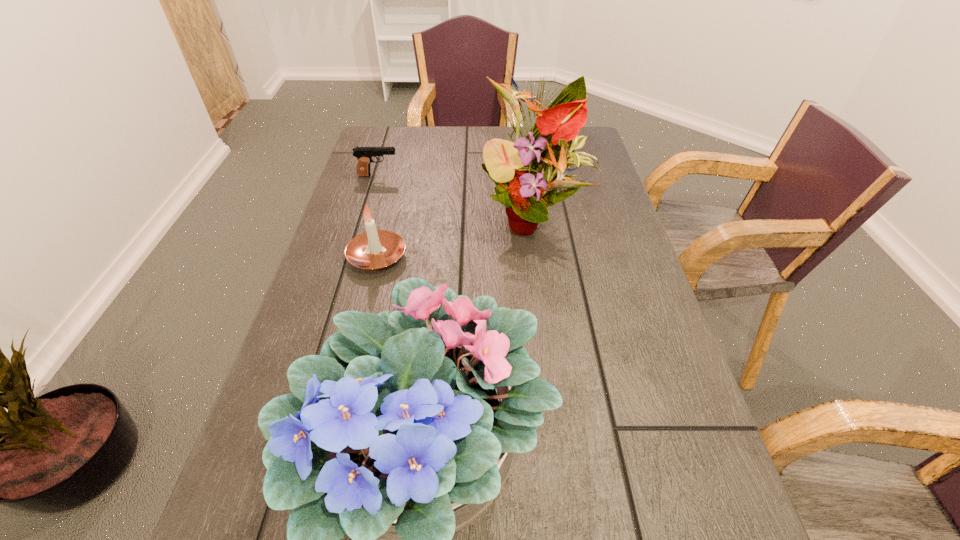
You are a GUI agent. You are given a task and a screenshot of the screen. Output one action in this format:
    pyautogui.click(x=<x>, y=<y>)
    Task: Click on the free space that satisfies the following two spatial constraints: 1. at the barrel of the shortest object; 2. on the back side of the third tallest object
    Image resolution: width=960 pixels, height=540 pixels.
    Given the screenshot: What is the action you would take?
    pyautogui.click(x=354, y=257)

This screenshot has height=540, width=960. I want to click on free space that satisfies the following two spatial constraints: 1. at the barrel of the farthest object; 2. on the right side of the candle, so click(x=354, y=257).